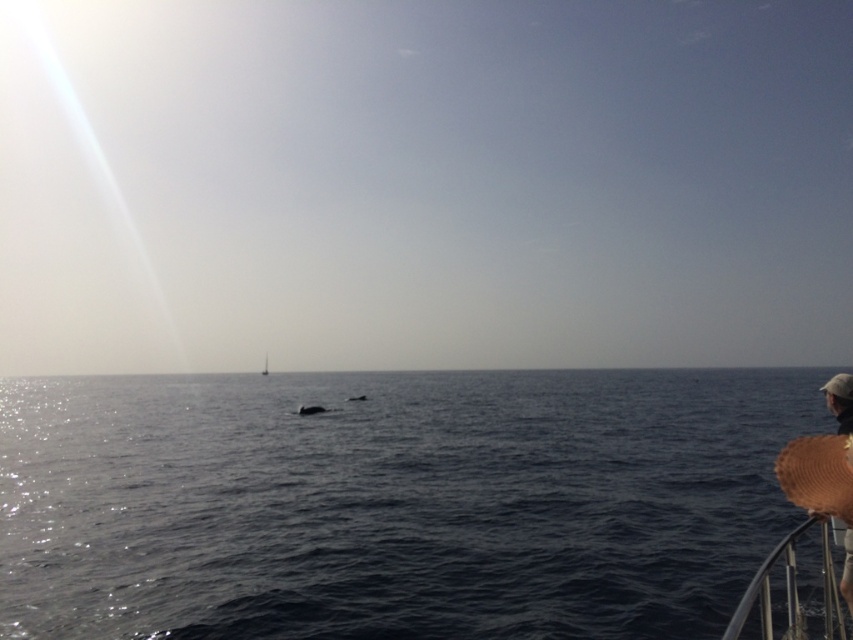
Can you confirm if brown straw hat at lower right is positioned to the right of white plastic boat at center?

Indeed, brown straw hat at lower right is positioned on the right side of white plastic boat at center.

You are a GUI agent. You are given a task and a screenshot of the screen. Output one action in this format:
    pyautogui.click(x=<x>, y=<y>)
    Task: Click on the brown straw hat at lower right
    This screenshot has width=853, height=640.
    Given the screenshot: What is the action you would take?
    pyautogui.click(x=839, y=401)

Is point (804, 456) positioned in front of point (267, 356)?

Yes, point (804, 456) is closer to viewer.

Between brown woven hat at lower right and white plastic boat at center, which one appears on the right side from the viewer's perspective?

Positioned to the right is brown woven hat at lower right.

Locate an element on the screen. This screenshot has height=640, width=853. brown woven hat at lower right is located at coordinates (817, 474).

Between dark blue water at center and white plastic boat at center, which one is positioned higher?

Positioned higher is dark blue water at center.

Between dark blue water at center and white plastic boat at center, which one has more height?

dark blue water at center is taller.

The height and width of the screenshot is (640, 853). I want to click on dark blue water at center, so click(x=392, y=502).